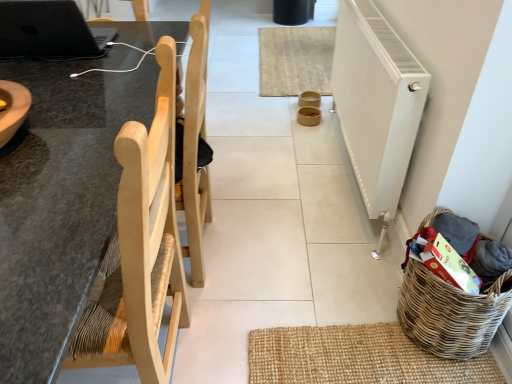
Question: Is black matte laptop at upper left to the right of natural fiber mat at center from the viewer's perspective?

Choices:
 (A) no
 (B) yes

Answer: (A)

Question: Can you confirm if black matte laptop at upper left is wider than natural fiber mat at center?

Choices:
 (A) no
 (B) yes

Answer: (A)

Question: Can you confirm if black matte laptop at upper left is shorter than natural fiber mat at center?

Choices:
 (A) no
 (B) yes

Answer: (A)

Question: From the image's perspective, is black matte laptop at upper left above natural fiber mat at center?

Choices:
 (A) yes
 (B) no

Answer: (B)

Question: Is black matte laptop at upper left next to natural fiber mat at center and touching it?

Choices:
 (A) no
 (B) yes

Answer: (A)

Question: Is black matte laptop at upper left to the left of natural fiber mat at center from the viewer's perspective?

Choices:
 (A) yes
 (B) no

Answer: (A)

Question: Is woven brown basket at lower right further to the viewer compared to natural fiber mat at center?

Choices:
 (A) yes
 (B) no

Answer: (B)

Question: From a real-world perspective, is woven brown basket at lower right on top of natural fiber mat at center?

Choices:
 (A) no
 (B) yes

Answer: (B)

Question: Is woven brown basket at lower right completely or partially outside of natural fiber mat at center?

Choices:
 (A) no
 (B) yes

Answer: (B)

Question: Does woven brown basket at lower right have a larger size compared to natural fiber mat at center?

Choices:
 (A) no
 (B) yes

Answer: (A)

Question: Could you tell me if woven brown basket at lower right is facing natural fiber mat at center?

Choices:
 (A) yes
 (B) no

Answer: (B)

Question: Is woven brown basket at lower right looking in the opposite direction of natural fiber mat at center?

Choices:
 (A) no
 (B) yes

Answer: (A)

Question: Is white textured radiator at right with natural fiber mat at center?

Choices:
 (A) no
 (B) yes

Answer: (A)